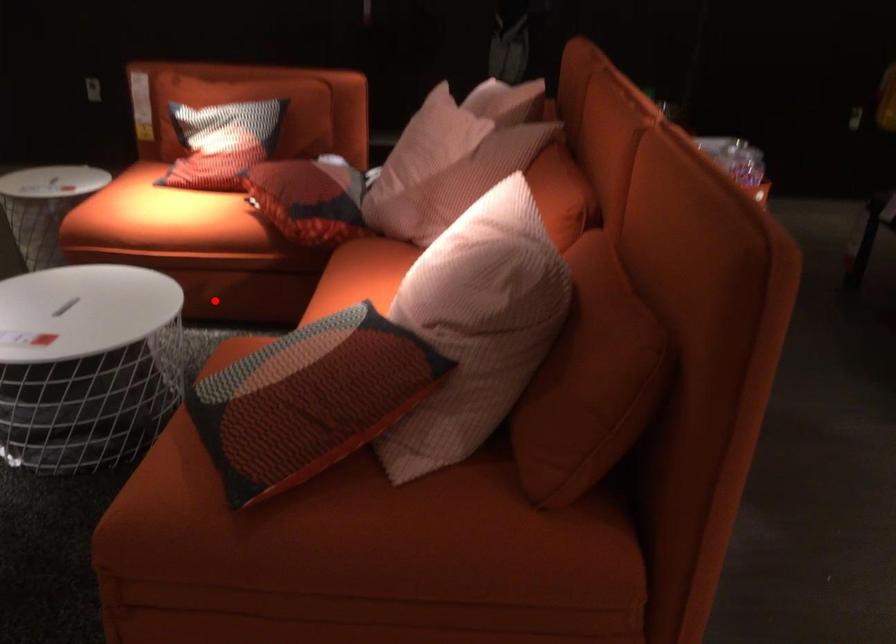
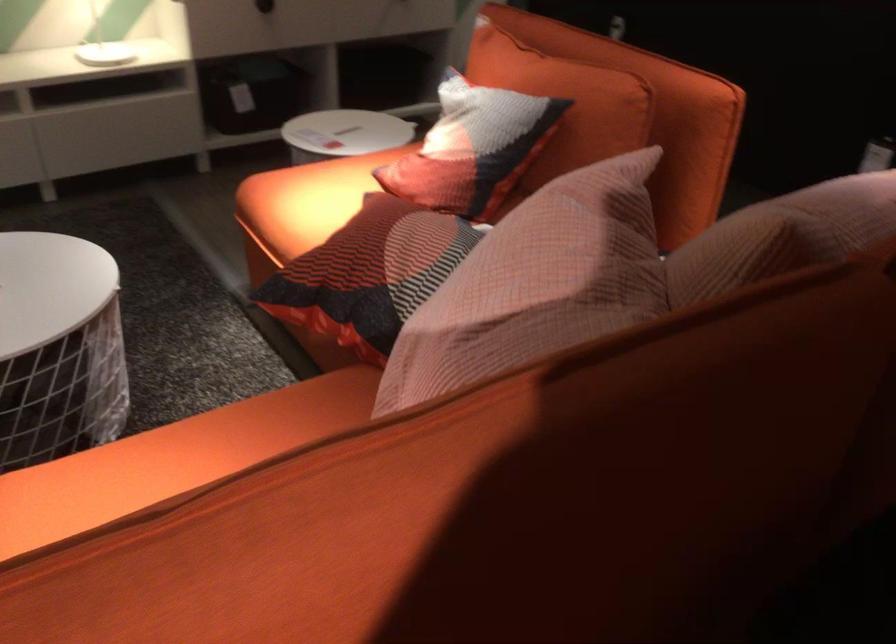
Question: I am providing you with two images of the same scene from different viewpoints. Given a red point in image1, look at the same physical point in image2. Is it:

Choices:
 (A) Closer to the viewpoint
 (B) Farther from the viewpoint

Answer: (A)